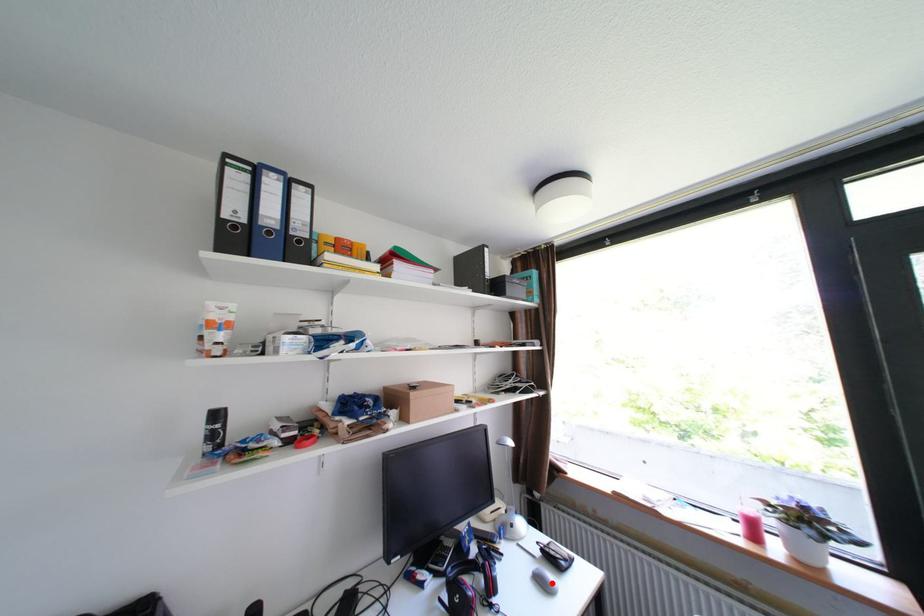
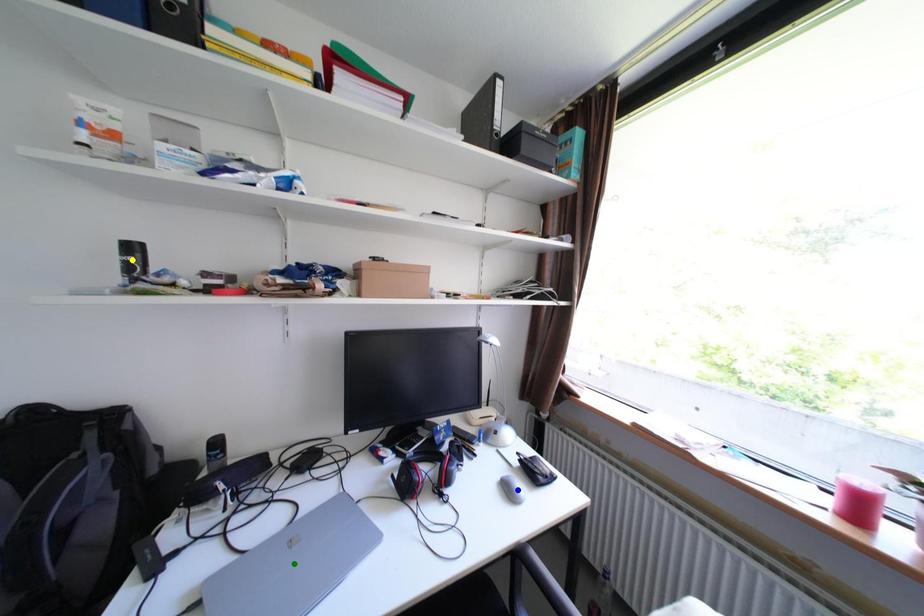
Question: I am providing you with two images of the same scene from different viewpoints. A red point is marked on the first image. You are given multiple points on the second image. In image 2, which mark is for the same physical point as the one in image 1?

Choices:
 (A) blue point
 (B) yellow point
 (C) green point

Answer: (A)